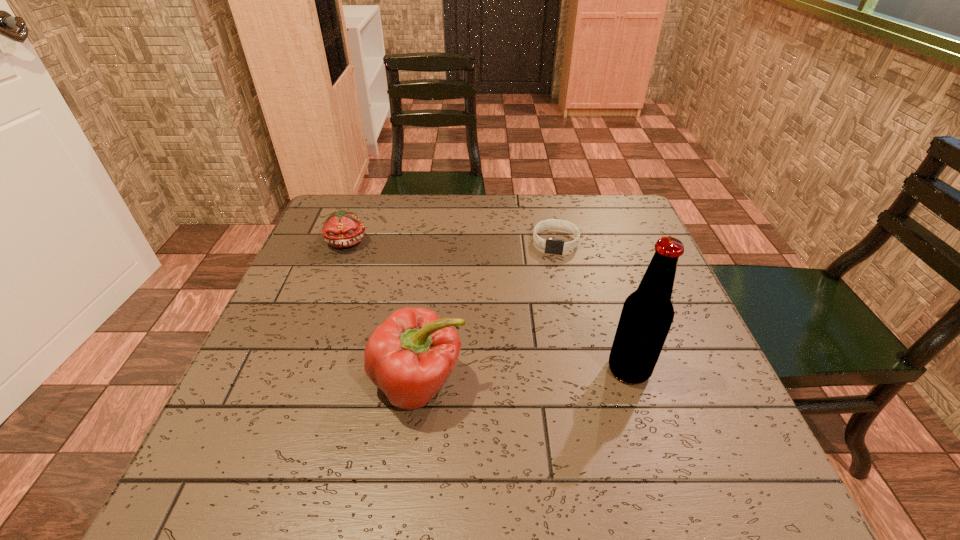
In the image, there is a desktop. Identify the location of vacant space at the far edge. The height and width of the screenshot is (540, 960). (427, 197).

The width and height of the screenshot is (960, 540). Find the location of `free region at the near edge of the desktop`. free region at the near edge of the desktop is located at coordinates (433, 430).

This screenshot has width=960, height=540. In the image, there is a desktop. In order to click on free space at the right edge in this screenshot , I will do `click(633, 256)`.

At what (x,y) coordinates should I click in order to perform the action: click on vacant space at the near left corner. Please return your answer as a coordinate pair (x, y). Looking at the image, I should click on (235, 424).

Identify the location of vacant space at the far right corner of the desktop. (583, 202).

You are a GUI agent. You are given a task and a screenshot of the screen. Output one action in this format:
    pyautogui.click(x=<x>, y=<y>)
    Task: Click on the vacant space that's between the shortest object and the beer bottle
    Image resolution: width=960 pixels, height=540 pixels.
    Given the screenshot: What is the action you would take?
    pyautogui.click(x=592, y=305)

Find the location of `free space between the wristband and the bell pepper`. free space between the wristband and the bell pepper is located at coordinates (488, 313).

You are a GUI agent. You are given a task and a screenshot of the screen. Output one action in this format:
    pyautogui.click(x=<x>, y=<y>)
    Task: Click on the free space between the third tallest object and the shortest object
    This screenshot has width=960, height=540.
    Given the screenshot: What is the action you would take?
    pyautogui.click(x=451, y=241)

You are a GUI agent. You are given a task and a screenshot of the screen. Output one action in this format:
    pyautogui.click(x=<x>, y=<y>)
    Task: Click on the unoccupied area between the beer bottle and the third object from right to left
    The height and width of the screenshot is (540, 960).
    Given the screenshot: What is the action you would take?
    pyautogui.click(x=524, y=376)

The image size is (960, 540). Find the location of `unoccupied area between the leftmost object and the bell pepper`. unoccupied area between the leftmost object and the bell pepper is located at coordinates (383, 313).